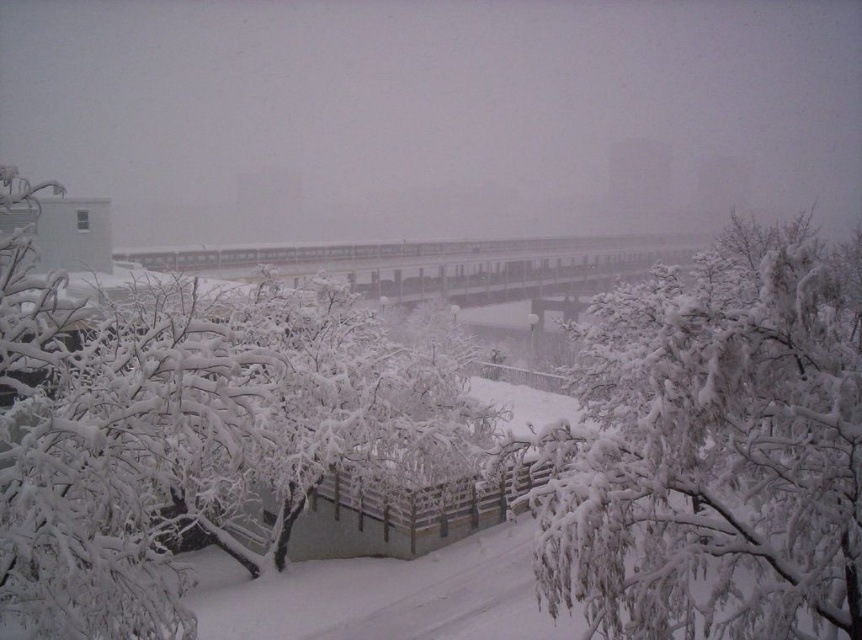
Can you confirm if white frosty tree at center is thinner than white frosty branches at center?

No.

Who is positioned more to the left, white frosty tree at center or white frosty branches at center?

white frosty tree at center

I want to click on white frosty tree at center, so click(186, 435).

The width and height of the screenshot is (862, 640). In order to click on white frosty tree at center in this screenshot , I will do `click(186, 435)`.